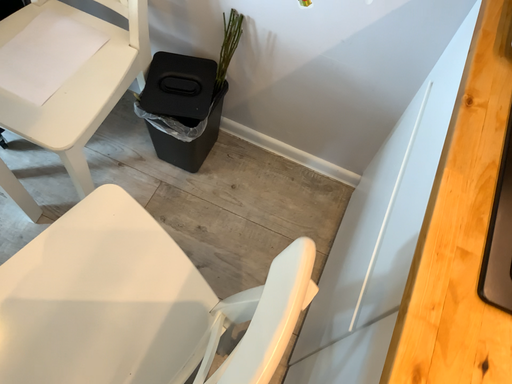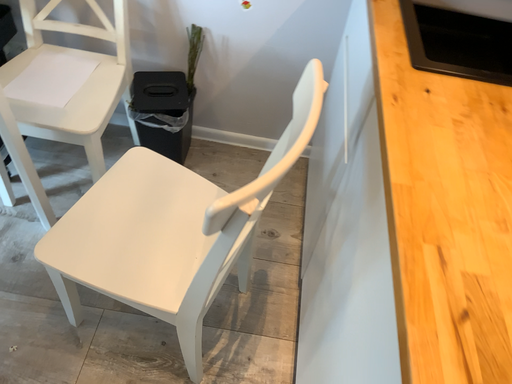
Question: Which way did the camera rotate in the video?

Choices:
 (A) rotated right
 (B) rotated left

Answer: (A)